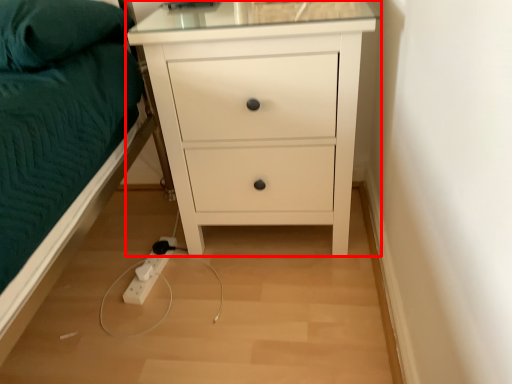
Question: Where is chest of drawers (annotated by the red box) located in relation to pillow in the image?

Choices:
 (A) left
 (B) right

Answer: (B)